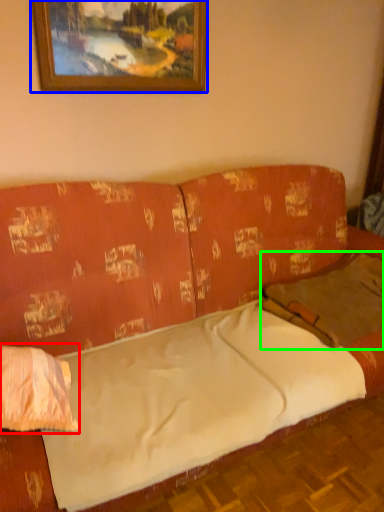
Question: Which object is positioned farthest from pillow (highlighted by a red box)? Select from picture frame (highlighted by a blue box) and pillow (highlighted by a green box).

Choices:
 (A) picture frame
 (B) pillow

Answer: (A)